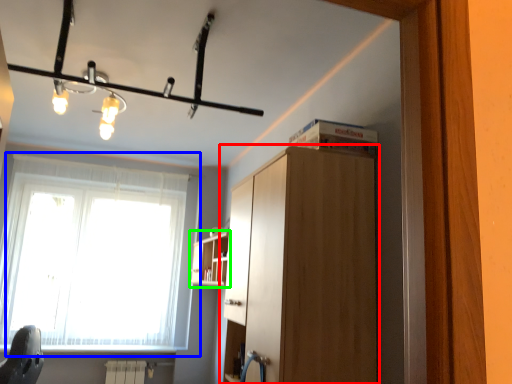
Question: Estimate the real-world distances between objects in this image. Which object is farther from cabinetry (highlighted by a red box), window (highlighted by a blue box) or shelf (highlighted by a green box)?

Choices:
 (A) window
 (B) shelf

Answer: (A)